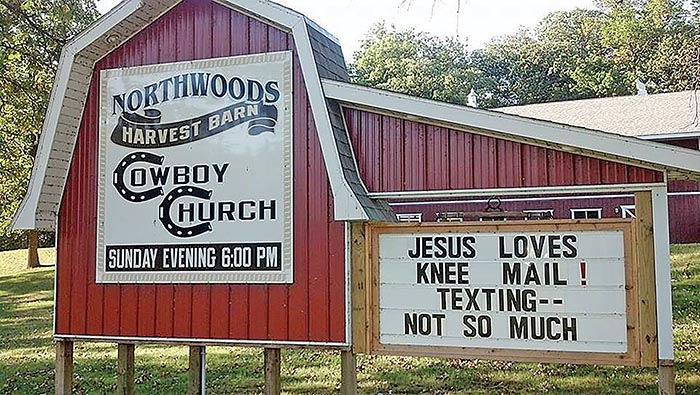
Identify the location of white frame. Image resolution: width=700 pixels, height=395 pixels. (335, 164).